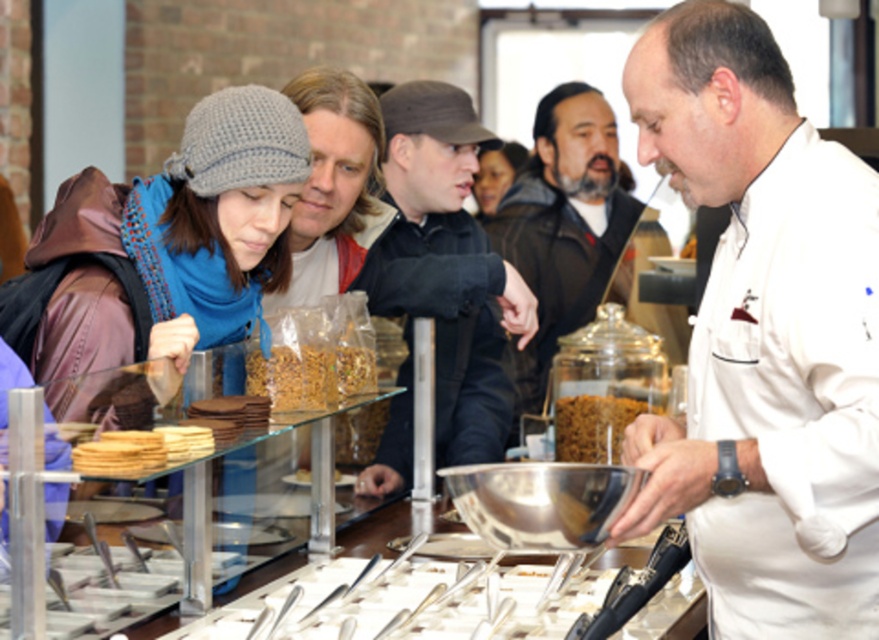
Question: Is golden crispy crackers at lower left further to the viewer compared to brown matte cookies at lower left?

Choices:
 (A) yes
 (B) no

Answer: (B)

Question: Is translucent plastic bag of nuts at center to the left of brown matte cookies at lower left from the viewer's perspective?

Choices:
 (A) no
 (B) yes

Answer: (A)

Question: Which of the following is the closest to the observer?

Choices:
 (A) (558, 218)
 (B) (155, 461)
 (C) (499, 422)
 (D) (238, 420)

Answer: (B)

Question: Considering the real-world distances, which object is closest to the brown matte cookies at lower left?

Choices:
 (A) black matte jacket at center
 (B) smooth brown hair at center
 (C) dark brown leather jacket at center
 (D) knitted gray hat at left

Answer: (D)

Question: Which point is closer to the camera taking this photo?

Choices:
 (A) (404, 440)
 (B) (134, 432)
 (C) (120, 228)

Answer: (B)

Question: Is translucent plastic bag of nuts at center below smooth brown hair at center?

Choices:
 (A) yes
 (B) no

Answer: (A)